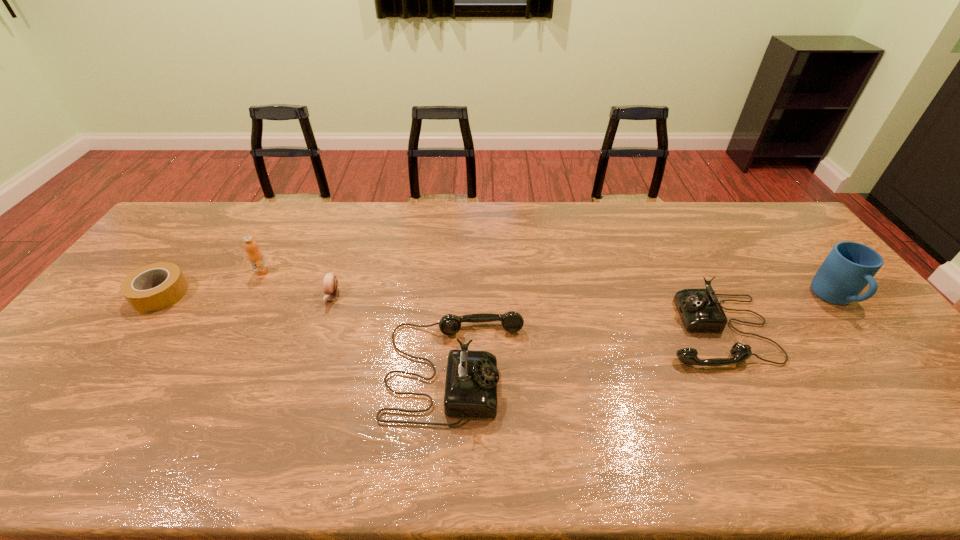
The width and height of the screenshot is (960, 540). I want to click on free space for a new telephone on the left, so click(x=150, y=415).